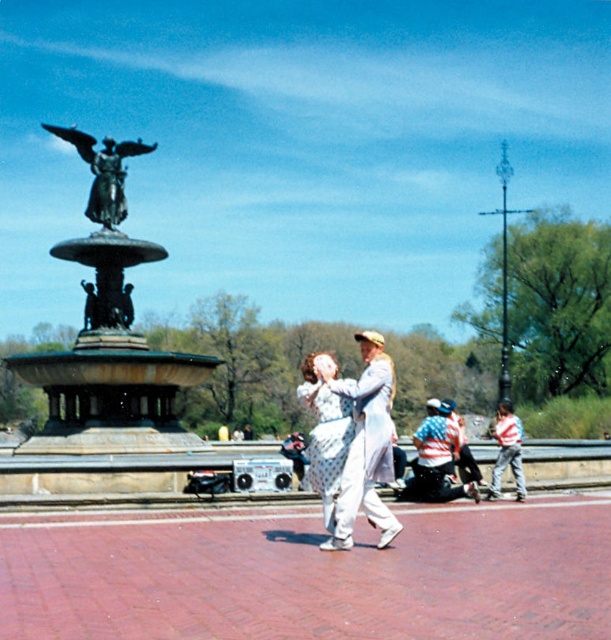
Question: Is bronze statue at center behind white dotted dress at center?

Choices:
 (A) no
 (B) yes

Answer: (B)

Question: Estimate the real-world distances between objects in this image. Which object is closer to the white dotted dress at center?

Choices:
 (A) bronze statue at center
 (B) bronze statue at upper left
 (C) striped shirt at center
 (D) striped shirt at lower right

Answer: (C)

Question: Which object is closer to the camera taking this photo?

Choices:
 (A) striped shirt at lower right
 (B) bronze statue at center
 (C) white dotted dress at center
 (D) bronze statue at upper left

Answer: (C)

Question: Which point appears closest to the camera in this image?

Choices:
 (A) click(448, 433)
 (B) click(101, 198)
 (C) click(359, 440)

Answer: (C)

Question: Does bronze statue at center appear under white dotted dress at center?

Choices:
 (A) yes
 (B) no

Answer: (B)

Question: Does bronze statue at center appear over bronze statue at upper left?

Choices:
 (A) yes
 (B) no

Answer: (B)